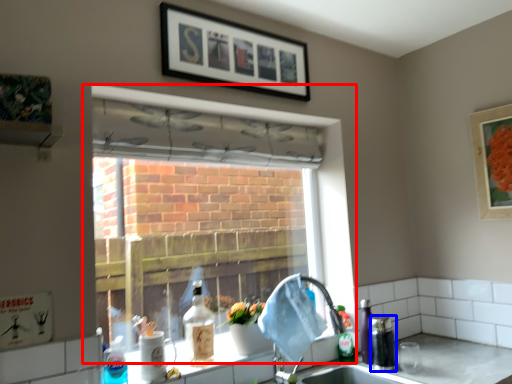
Question: Which object is closer to the camera taking this photo, window (highlighted by a red box) or beverage (highlighted by a blue box)?

Choices:
 (A) window
 (B) beverage

Answer: (A)